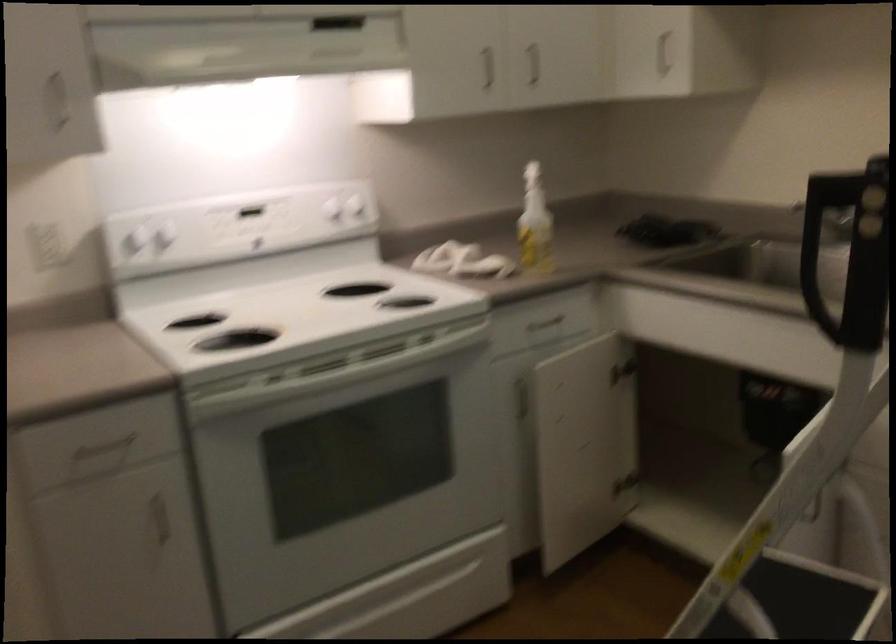
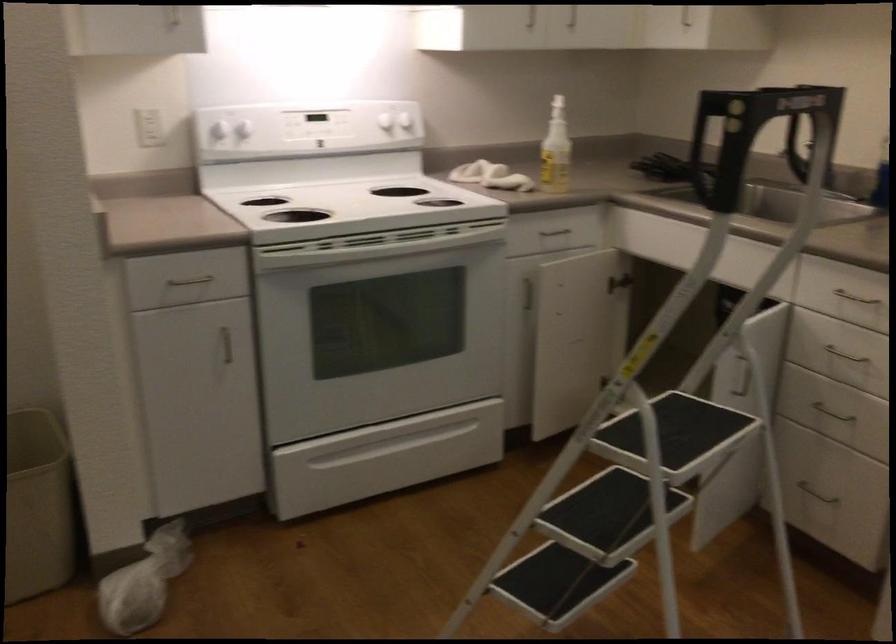
Find the pixel in the second image that matches point 107,436 in the first image.

(191, 272)